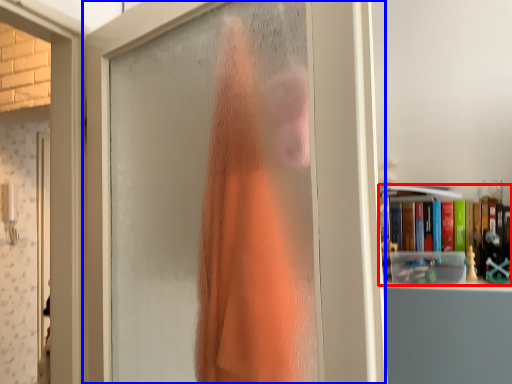
Question: Which object is further to the camera taking this photo, book (highlighted by a red box) or door (highlighted by a blue box)?

Choices:
 (A) book
 (B) door

Answer: (A)